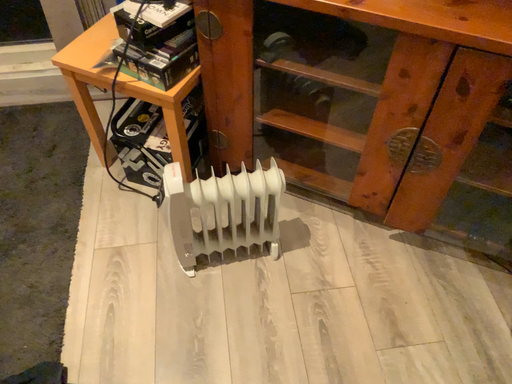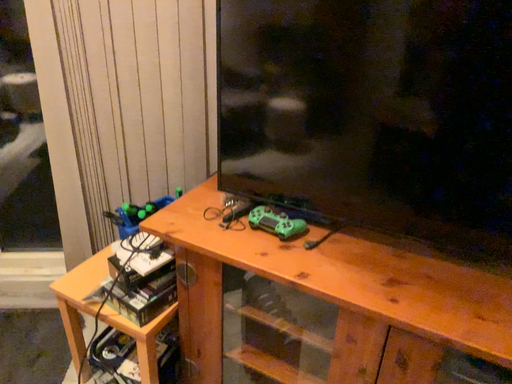
Question: Which way did the camera rotate in the video?

Choices:
 (A) rotated upward
 (B) rotated downward

Answer: (A)